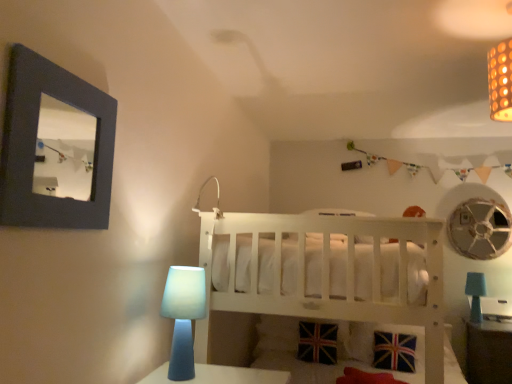
Question: Is union jack fabric pillow at lower center positioned before blue matte table lamp at lower left, marked as the first table lamp in a left-to-right arrangement?

Choices:
 (A) yes
 (B) no

Answer: (B)

Question: Is union jack fabric pillow at lower center with blue matte table lamp at lower left, placed as the first table lamp when sorted from front to back?

Choices:
 (A) yes
 (B) no

Answer: (B)

Question: Is union jack fabric pillow at lower center aimed at blue matte table lamp at lower left, marked as the first table lamp in a left-to-right arrangement?

Choices:
 (A) yes
 (B) no

Answer: (A)

Question: Would you say union jack fabric pillow at lower center is outside blue matte table lamp at lower left, which is counted as the 2th table lamp, starting from the bottom?

Choices:
 (A) no
 (B) yes

Answer: (B)

Question: Is union jack fabric pillow at lower center at the left side of blue matte table lamp at lower left, acting as the second table lamp starting from the back?

Choices:
 (A) yes
 (B) no

Answer: (B)

Question: In terms of size, does union jack fabric pillow at lower center appear bigger or smaller than matte white lamp at upper center?

Choices:
 (A) big
 (B) small

Answer: (A)

Question: Is union jack fabric pillow at lower center to the left or to the right of matte white lamp at upper center in the image?

Choices:
 (A) right
 (B) left

Answer: (A)

Question: Is point (371, 344) closer or farther from the camera than point (219, 201)?

Choices:
 (A) farther
 (B) closer

Answer: (A)

Question: From the image's perspective, is union jack fabric pillow at lower center positioned above or below matte white lamp at upper center?

Choices:
 (A) below
 (B) above

Answer: (A)

Question: From a real-world perspective, relative to blue matte table lamp at lower right, which is counted as the 2th table lamp, starting from the left, is metallic silver mechanical fan at upper right vertically above or below?

Choices:
 (A) below
 (B) above

Answer: (B)

Question: From the image's perspective, is metallic silver mechanical fan at upper right positioned above or below blue matte table lamp at lower right, which appears as the 1th table lamp when ordered from the bottom?

Choices:
 (A) above
 (B) below

Answer: (A)

Question: Looking at their shapes, would you say metallic silver mechanical fan at upper right is wider or thinner than blue matte table lamp at lower right, which is counted as the 2th table lamp, starting from the left?

Choices:
 (A) wide
 (B) thin

Answer: (B)

Question: Is metallic silver mechanical fan at upper right to the left or to the right of blue matte table lamp at lower right, which ranks as the 2th table lamp in top-to-bottom order, in the image?

Choices:
 (A) left
 (B) right

Answer: (B)

Question: From a real-world perspective, is matte white lamp at upper center physically located above or below white wooden crib at center?

Choices:
 (A) below
 (B) above

Answer: (B)

Question: Is point [x=216, y=178] positioned closer to the camera than point [x=412, y=279]?

Choices:
 (A) farther
 (B) closer

Answer: (A)